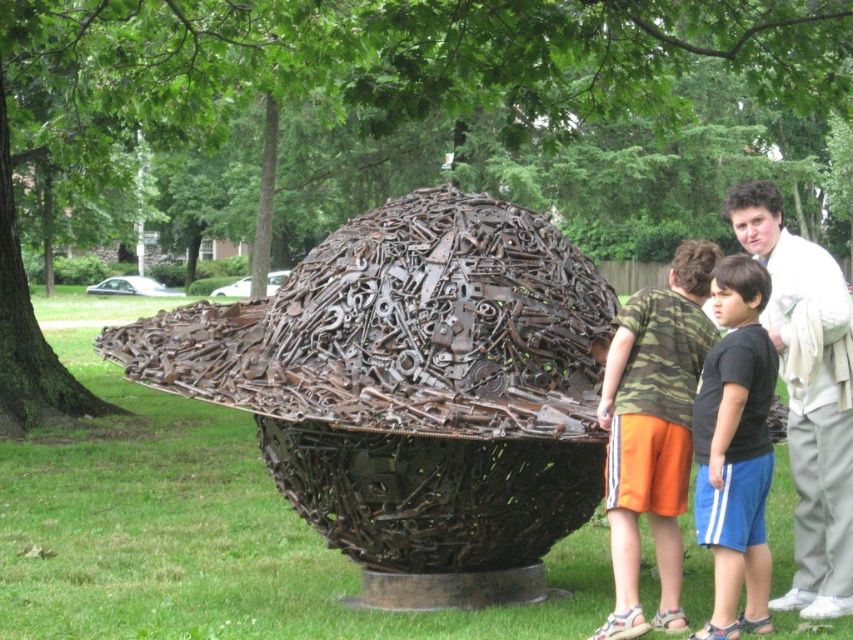
You are a photographer trying to capture a group photo of the two children near the sculpture. The children are wearing white cotton shirt at right and black cotton shirt at center. To ensure both are in frame, where should you position the camera relative to the sculpture?

You should position the camera to the left of the sculpture because the white cotton shirt at right is to the right of the black cotton shirt at center, so placing the camera to the left would allow both children to be captured in the frame.

What object is located at the coordinates point (415,392) in the image?

The point (415,392) indicates the rusty metal sphere at center.

You are a photographer trying to capture a photo of the sculpture. You notice two people wearing white cotton shirt at right and black cotton shirt at center. Which person is positioned higher in the frame?

The white cotton shirt at right is located above the black cotton shirt at center, so the person wearing the white cotton shirt at right is positioned higher in the frame.